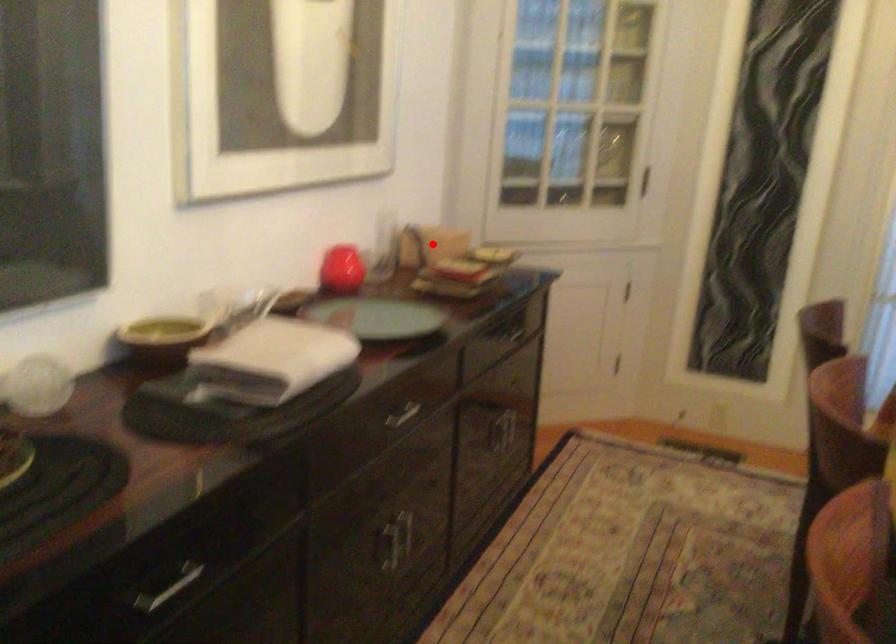
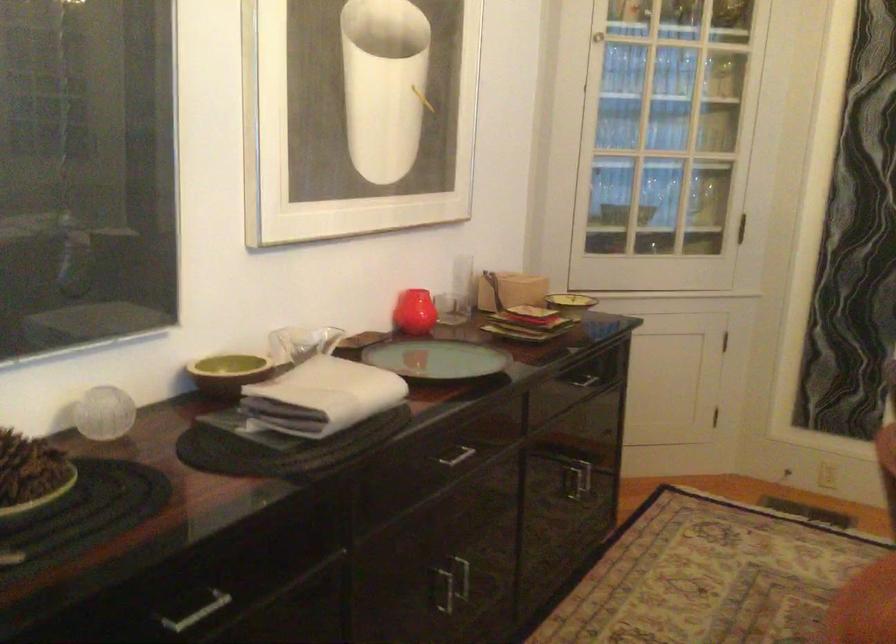
The point at the highlighted location is marked in the first image. Where is the corresponding point in the second image?

(510, 290)